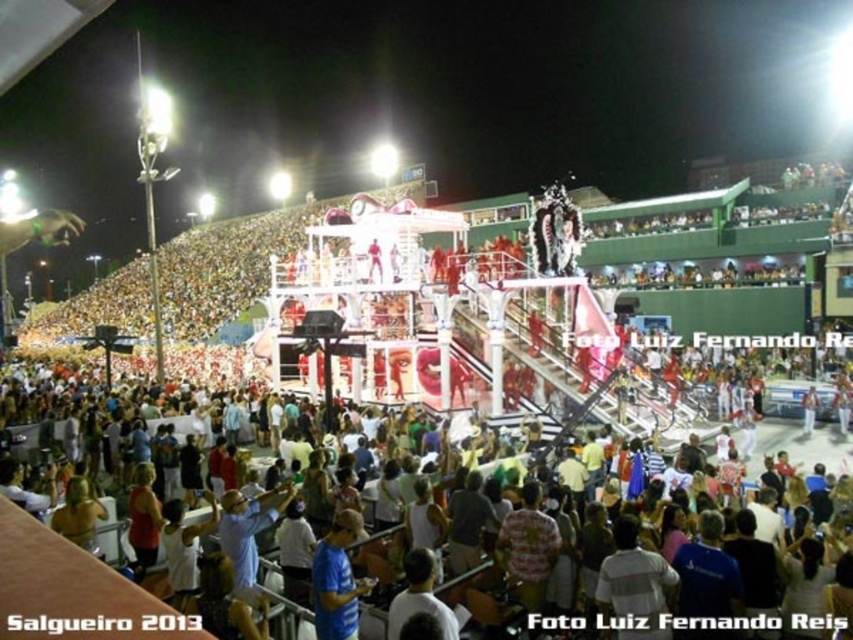
Question: Which object appears farthest from the camera in this image?

Choices:
 (A) white cotton crowd at lower center
 (B) blue fabric shirt at lower center

Answer: (B)

Question: Can you confirm if white cotton crowd at lower center is bigger than blue fabric shirt at lower center?

Choices:
 (A) yes
 (B) no

Answer: (A)

Question: Does white cotton crowd at lower center have a smaller size compared to blue fabric shirt at lower center?

Choices:
 (A) no
 (B) yes

Answer: (A)

Question: Can you confirm if white cotton crowd at lower center is positioned to the right of blue fabric shirt at lower center?

Choices:
 (A) no
 (B) yes

Answer: (A)